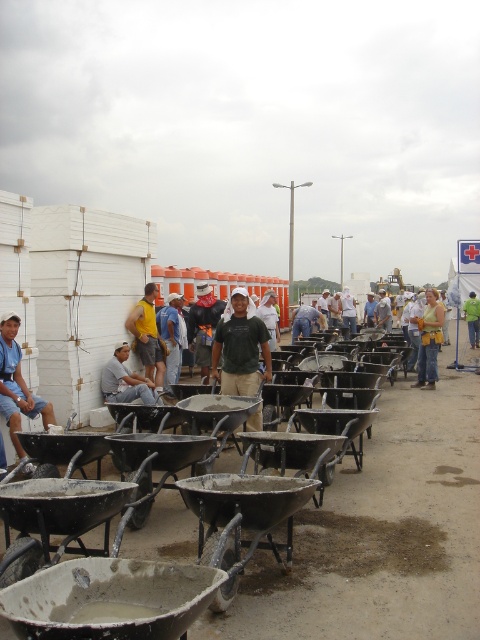
You are a safety inspector at the construction site. You need to check the shirts of the workers to ensure they meet the safety standards. According to the safety manual, the shirt must have a minimum thickness of 0.5 cm. Which worker, the matte blue shirt at left or the dark green shirt at center, might have a compliant shirt?

The dark green shirt at center is thicker than the matte blue shirt at left. Since the safety manual requires a minimum thickness of 0.5 cm, the dark green shirt at center likely meets the requirement, while the matte blue shirt at left might be too thin.